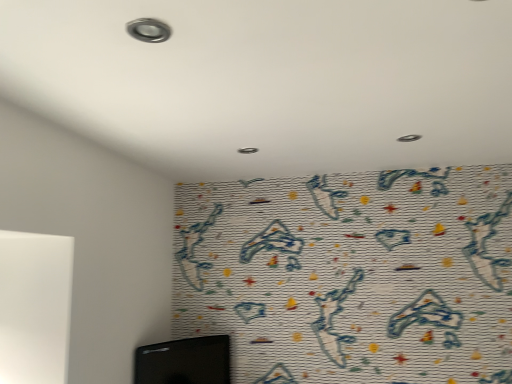
What is the approximate width of black glossy desktop at lower left?

The width of black glossy desktop at lower left is 11.31 centimeters.

What do you see at coordinates (184, 361) in the screenshot? The image size is (512, 384). I see `black glossy desktop at lower left` at bounding box center [184, 361].

Find the location of a particular element. Image resolution: width=512 pixels, height=384 pixels. black glossy desktop at lower left is located at coordinates (184, 361).

Where is `black glossy desktop at lower left`? The image size is (512, 384). black glossy desktop at lower left is located at coordinates coord(184,361).